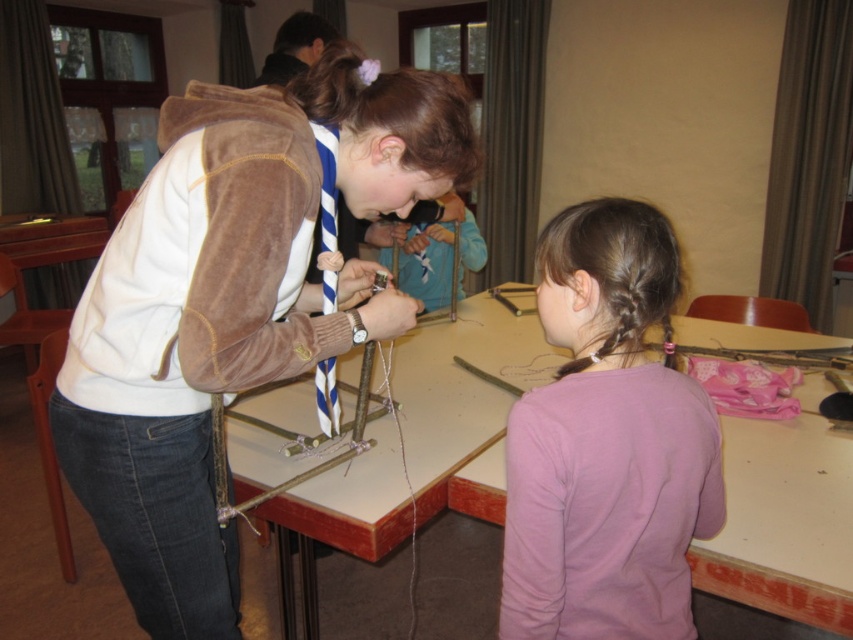
You are organizing a craft activity and need to ensure there is enough space for participants. Given the pink matte shirt at center and the wooden table at center, which object takes up more horizontal space?

The wooden table at center has a greater width than the pink matte shirt at center, so it occupies more horizontal space.

You are a photographer trying to capture a closeup of the wooden table at center without the brown suede jacket at upper left blocking the view. Based on their relative heights, is this possible?

The brown suede jacket at upper left is taller than the wooden table at center, so it will block the view of the wooden table at center. You cannot capture a closeup of the wooden table at center without the jacket blocking the view.

You are a teacher in the classroom and want to hand out a craft kit to both the child wearing the brown suede jacket at upper left and the child in the pink matte shirt at center. If the craft kit is 16 inches wide, can you place it between them so both can reach it easily?

The brown suede jacket at upper left and pink matte shirt at center are 17.50 inches apart. Since the craft kit is 16 inches wide, placing it between them would leave 1.5 inches of space on either side, allowing both children to reach it comfortably.